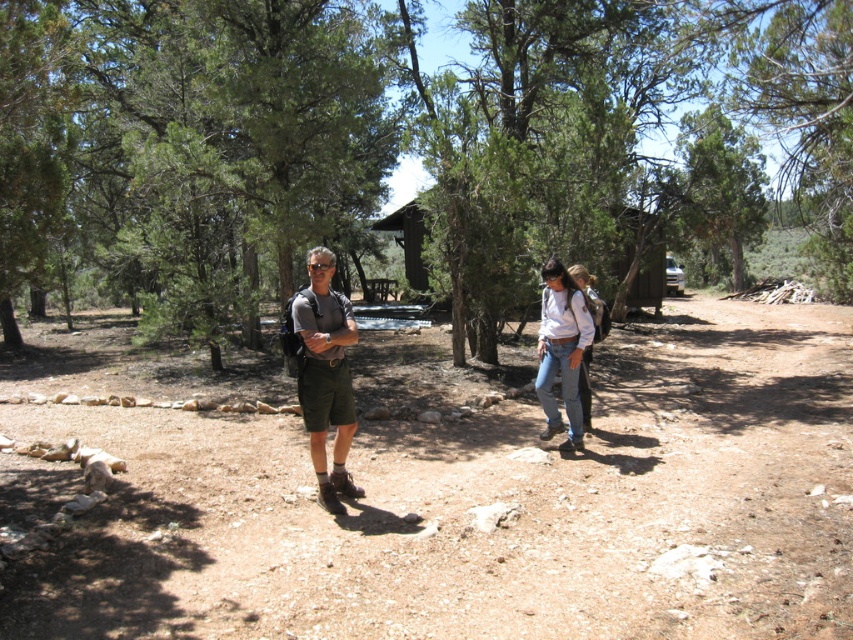
Who is more forward, (122, 138) or (546, 324)?

Point (546, 324) is more forward.

Describe the element at coordinates (402, 144) in the screenshot. The height and width of the screenshot is (640, 853). I see `green leafy tree at center` at that location.

Does point (549, 92) come in front of point (547, 422)?

No, it is not.

You are a GUI agent. You are given a task and a screenshot of the screen. Output one action in this format:
    pyautogui.click(x=<x>, y=<y>)
    Task: Click on the green leafy tree at center
    
    Given the screenshot: What is the action you would take?
    pyautogui.click(x=402, y=144)

Looking at this image, how distant is matte khaki shorts at center from jeans at center?

matte khaki shorts at center is 2.40 meters from jeans at center.

Is matte khaki shorts at center wider than jeans at center?

Correct, the width of matte khaki shorts at center exceeds that of jeans at center.

Which is behind, point (316, 404) or point (550, 404)?

The point (550, 404) is more distant.

Where is `matte khaki shorts at center`? The height and width of the screenshot is (640, 853). matte khaki shorts at center is located at coordinates (325, 376).

Which is in front, point (691, 54) or point (302, 404)?

Point (302, 404)

Which is behind, point (560, 65) or point (338, 472)?

Positioned behind is point (560, 65).

Does point (370, 209) come closer to viewer compared to point (318, 499)?

No, it is not.

At what (x,y) coordinates should I click in order to perform the action: click on green leafy tree at center. Please return your answer as a coordinate pair (x, y). Looking at the image, I should click on (402, 144).